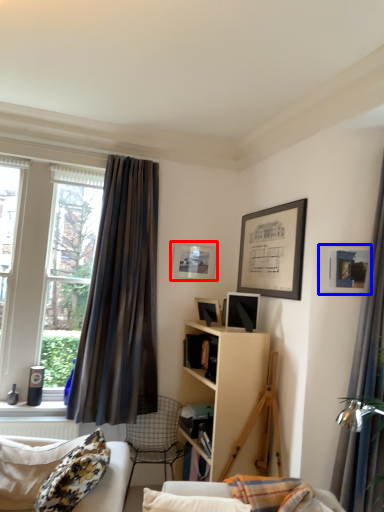
Question: Which of the following is the closest to the observer, picture frame (highlighted by a red box) or picture frame (highlighted by a blue box)?

Choices:
 (A) picture frame
 (B) picture frame

Answer: (B)